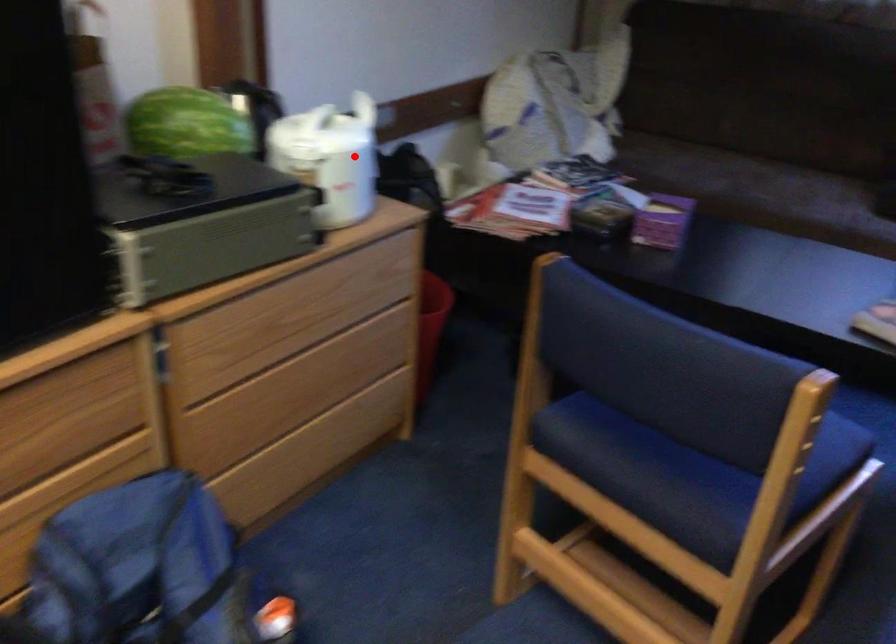
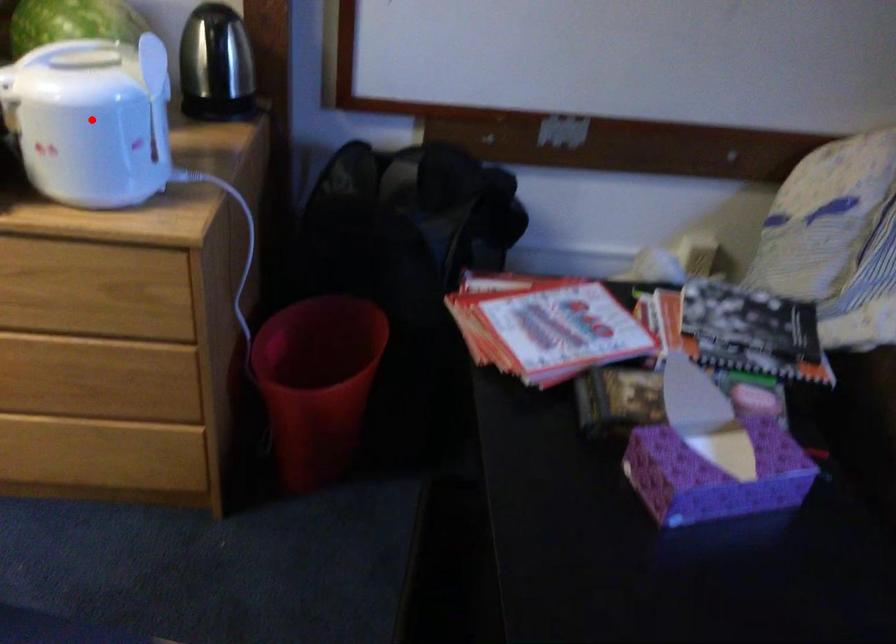
I am providing you with two images of the same scene from different viewpoints. A red point is marked on the first image and another point is marked on the second image. Do the highlighted points in image1 and image2 indicate the same real-world spot?

Yes